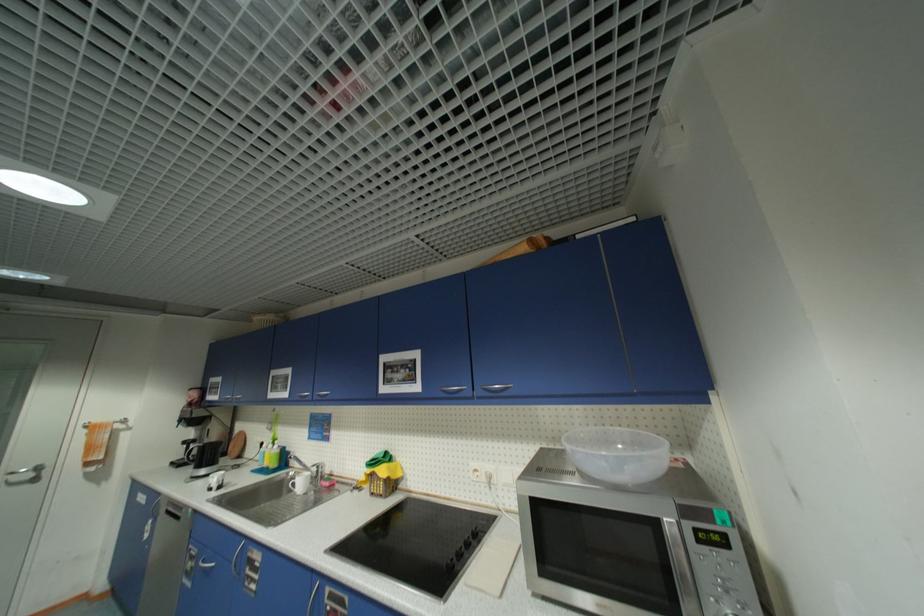
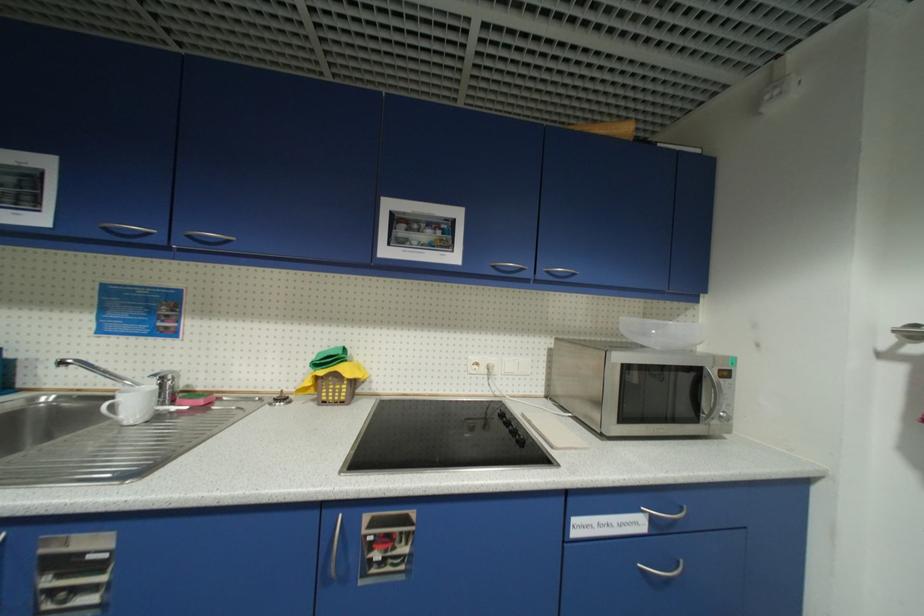
Question: Based on the continuous images, in which direction is the camera rotating? Reply with the corresponding letter.

Choices:
 (A) Left
 (B) Right
 (C) Up
 (D) Down

Answer: (B)